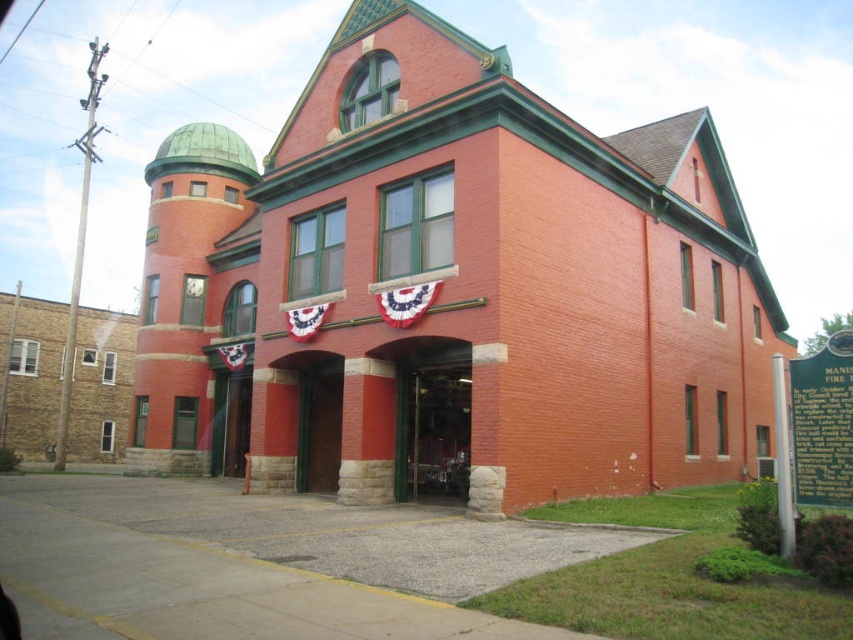
Looking at this image, you are a delivery person trying to enter the building through the door. The package you are carrying is too large to fit through a standard door height. Which door should you choose between the metallic glass door at center and the green wooden door at center?

The metallic glass door at center is much taller than the green wooden door at center, so you should choose the metallic glass door at center to accommodate your large package.

You are a delivery person trying to enter the building. You see the metallic glass door at center and the green wooden door at center. Which door should you use if you need to carry a large package that requires a wide opening?

The metallic glass door at center is larger in size than the green wooden door at center, so you should use the metallic glass door at center to carry your large package through the wider opening.